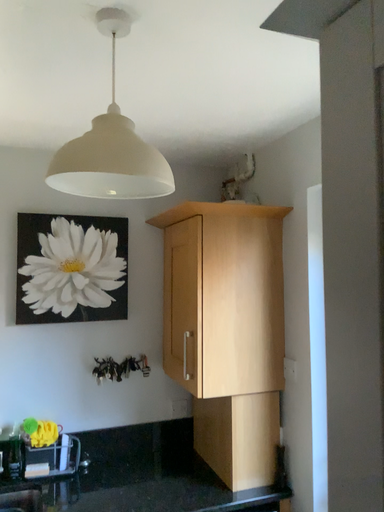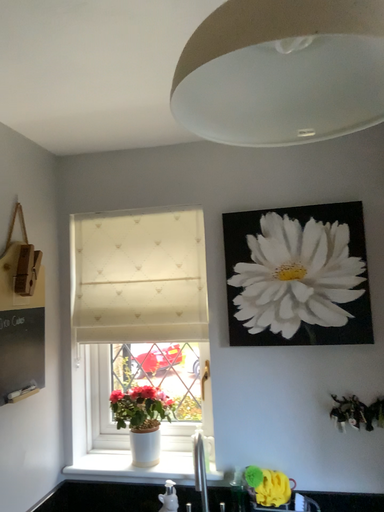
Question: How did the camera likely rotate when shooting the video?

Choices:
 (A) rotated right
 (B) rotated left

Answer: (B)